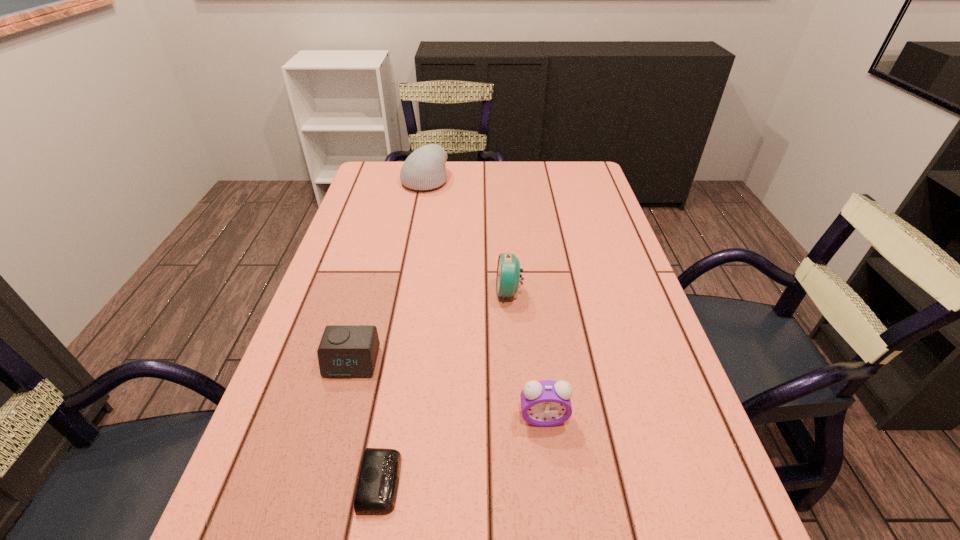
This screenshot has height=540, width=960. Identify the location of beanie. (424, 169).

Locate an element on the screen. This screenshot has width=960, height=540. the fourth nearest object is located at coordinates (508, 275).

In order to click on the second nearest object in this screenshot , I will do `click(545, 403)`.

The image size is (960, 540). In order to click on the second shortest alarm clock in this screenshot , I will do `click(345, 351)`.

Locate an element on the screen. the third nearest alarm clock is located at coordinates (345, 351).

I want to click on the second alarm clock from left to right, so click(376, 492).

You are a GUI agent. You are given a task and a screenshot of the screen. Output one action in this format:
    pyautogui.click(x=<x>, y=<y>)
    Task: Click on the nearest alarm clock
    
    Given the screenshot: What is the action you would take?
    pyautogui.click(x=376, y=492)

Locate an element on the screen. This screenshot has width=960, height=540. vacant position located 0.230m on the front of the farthest object is located at coordinates (414, 236).

This screenshot has height=540, width=960. What are the coordinates of `blank space located on the front-facing side of the fourth nearest object` in the screenshot? It's located at (384, 292).

Find the location of `free location located 0.150m on the front-facing side of the fourth nearest object`. free location located 0.150m on the front-facing side of the fourth nearest object is located at coordinates (x=434, y=292).